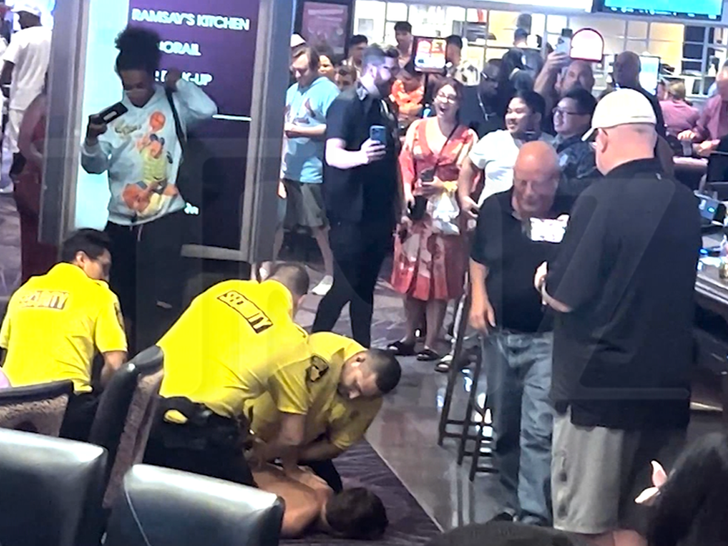
This screenshot has width=728, height=546. I want to click on barstool legs, so click(x=455, y=360), click(x=475, y=379), click(x=480, y=440).